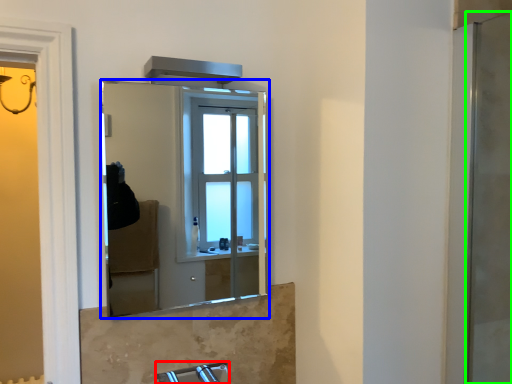
Question: Which is nearer to the faucet (highlighted by a red box)? mirror (highlighted by a blue box) or screen door (highlighted by a green box).

Choices:
 (A) mirror
 (B) screen door

Answer: (B)